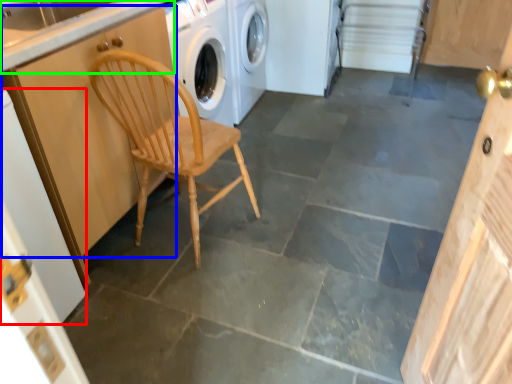
Question: Considering the real-world distances, which object is farthest from door (highlighted by a red box)? cabinetry (highlighted by a blue box) or counter top (highlighted by a green box)?

Choices:
 (A) cabinetry
 (B) counter top

Answer: (B)